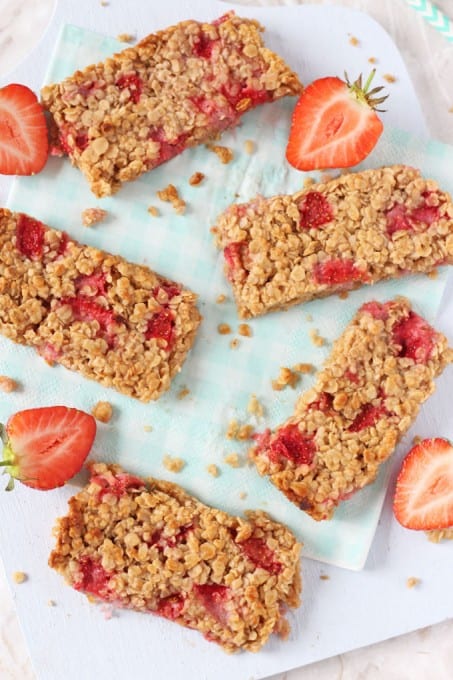
You are a GUI agent. You are given a task and a screenshot of the screen. Output one action in this format:
    pyautogui.click(x=<x>, y=<y>)
    Task: Click on the checkered dishtowel
    
    Given the screenshot: What is the action you would take?
    pyautogui.click(x=257, y=180), pyautogui.click(x=216, y=364), pyautogui.click(x=202, y=464), pyautogui.click(x=357, y=542), pyautogui.click(x=53, y=384), pyautogui.click(x=62, y=197), pyautogui.click(x=77, y=44), pyautogui.click(x=416, y=154)